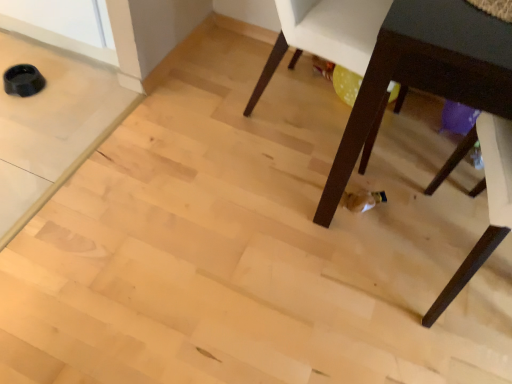
Question: Is dark wood table at lower right positioned before white plastic chair at center, which is the 1th chair from left to right?

Choices:
 (A) no
 (B) yes

Answer: (B)

Question: Is dark wood table at lower right further to camera compared to white plastic chair at center, arranged as the second chair when ordered from the bottom?

Choices:
 (A) yes
 (B) no

Answer: (B)

Question: Considering the relative sizes of dark wood table at lower right and white plastic chair at center, which is the 1th chair from left to right, in the image provided, is dark wood table at lower right bigger than white plastic chair at center, which is the 1th chair from left to right,?

Choices:
 (A) no
 (B) yes

Answer: (B)

Question: Would you say dark wood table at lower right is a long distance from white plastic chair at center, arranged as the second chair when ordered from the bottom?

Choices:
 (A) no
 (B) yes

Answer: (A)

Question: From a real-world perspective, is dark wood table at lower right located beneath white plastic chair at center, arranged as the second chair when ordered from the bottom?

Choices:
 (A) no
 (B) yes

Answer: (A)

Question: Relative to dark wood table at lower right, is white plastic chair at center, which is the 1th chair from left to right, in front or behind?

Choices:
 (A) front
 (B) behind

Answer: (B)

Question: Is white plastic chair at center, acting as the 2th chair starting from the right, inside or outside of dark wood table at lower right?

Choices:
 (A) outside
 (B) inside

Answer: (A)

Question: Is white plastic chair at center, which is the first chair in top-to-bottom order, to the left or to the right of dark wood table at lower right in the image?

Choices:
 (A) left
 (B) right

Answer: (A)

Question: From the image's perspective, is white plastic chair at center, acting as the 2th chair starting from the right, positioned above or below dark wood table at lower right?

Choices:
 (A) below
 (B) above

Answer: (B)

Question: Is dark wood table at lower right taller or shorter than dark wood chair at lower right, the first chair viewed from the right?

Choices:
 (A) tall
 (B) short

Answer: (A)

Question: Is dark wood table at lower right in front of or behind dark wood chair at lower right, the first chair viewed from the right, in the image?

Choices:
 (A) front
 (B) behind

Answer: (A)

Question: Looking at their shapes, would you say dark wood table at lower right is wider or thinner than dark wood chair at lower right, arranged as the 2th chair when viewed from the left?

Choices:
 (A) thin
 (B) wide

Answer: (B)

Question: Looking at the image, does dark wood table at lower right seem bigger or smaller compared to dark wood chair at lower right, the first chair viewed from the right?

Choices:
 (A) small
 (B) big

Answer: (B)

Question: Is dark wood chair at lower right, the second chair from the top, situated inside white plastic chair at center, which is the 1th chair from left to right, or outside?

Choices:
 (A) inside
 (B) outside

Answer: (B)

Question: Is dark wood chair at lower right, arranged as the 2th chair when viewed from the left, wider or thinner than white plastic chair at center, which is the 1th chair from left to right?

Choices:
 (A) wide
 (B) thin

Answer: (A)